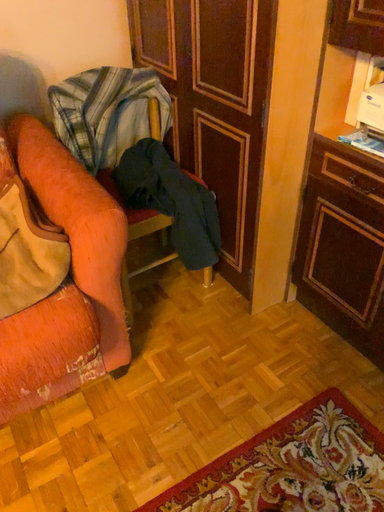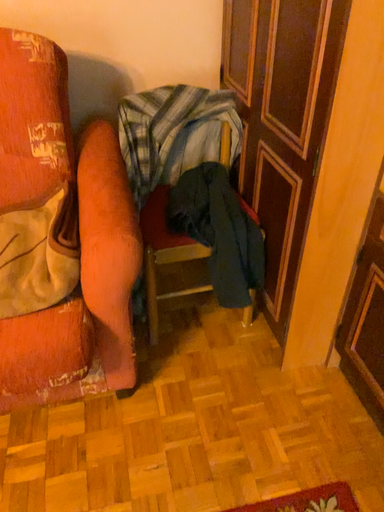
Question: Which way did the camera rotate in the video?

Choices:
 (A) rotated left
 (B) rotated right

Answer: (A)